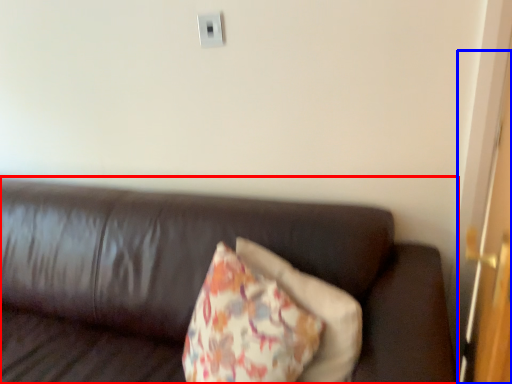
Question: Which object appears closest to the camera in this image, studio couch (highlighted by a red box) or door (highlighted by a blue box)?

Choices:
 (A) studio couch
 (B) door

Answer: (B)